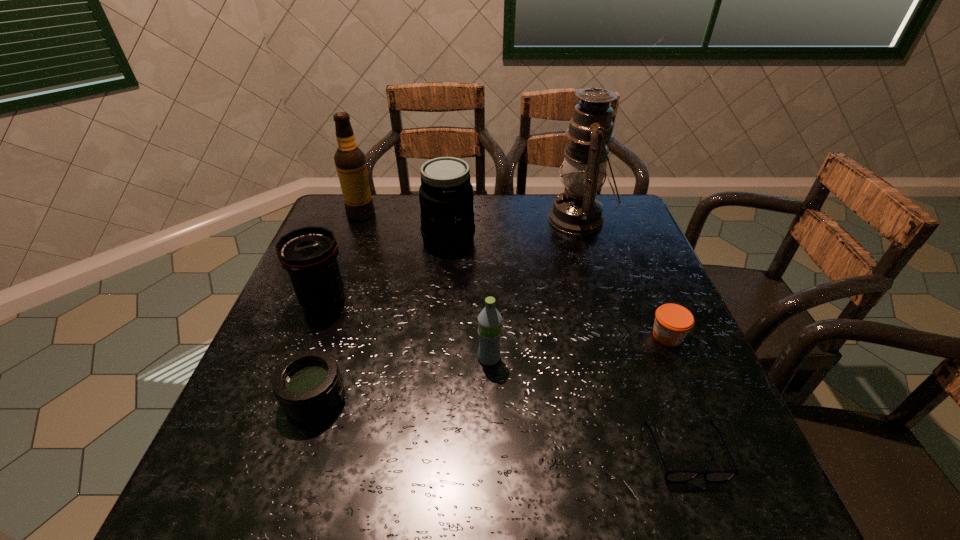
This screenshot has width=960, height=540. What are the coordinates of `oil lamp located at the far edge` in the screenshot? It's located at (577, 210).

I want to click on alcohol situated at the far edge, so click(350, 161).

Locate an element on the screen. The image size is (960, 540). telephoto lens at the far edge is located at coordinates (446, 197).

Where is `object that is at the near edge`? object that is at the near edge is located at coordinates (675, 476).

Where is `alcohol positioned at the left edge`? The width and height of the screenshot is (960, 540). alcohol positioned at the left edge is located at coordinates (350, 161).

The image size is (960, 540). Identify the location of oil lamp located at the right edge. (577, 210).

I want to click on jam located in the right edge section of the desktop, so click(x=672, y=323).

The width and height of the screenshot is (960, 540). I want to click on spectacles positioned at the right edge, so click(675, 476).

This screenshot has width=960, height=540. Identify the location of object that is positioned at the far left corner. (350, 161).

You are a GUI agent. You are given a task and a screenshot of the screen. Output one action in this format:
    pyautogui.click(x=<x>, y=<y>)
    Task: Click on the object positioned at the far right corner
    This screenshot has height=540, width=960.
    Given the screenshot: What is the action you would take?
    pyautogui.click(x=577, y=210)